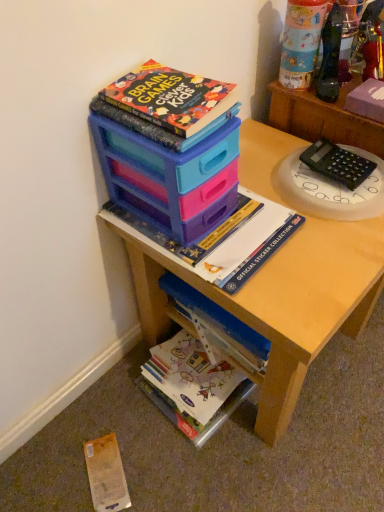
Where is `vacant area that lies between wooden desk at center and yellow paper at lower left`? The width and height of the screenshot is (384, 512). vacant area that lies between wooden desk at center and yellow paper at lower left is located at coordinates (152, 436).